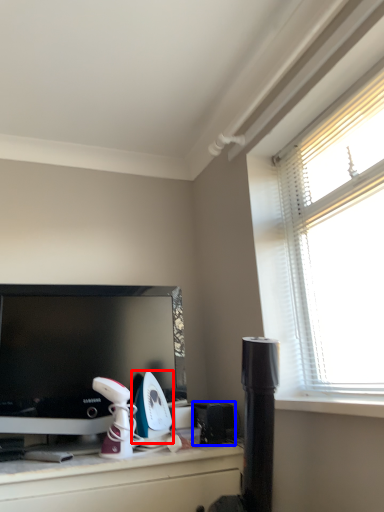
Question: Which point is further to the camera, appliance (highlighted by a red box) or appliance (highlighted by a blue box)?

Choices:
 (A) appliance
 (B) appliance

Answer: (B)